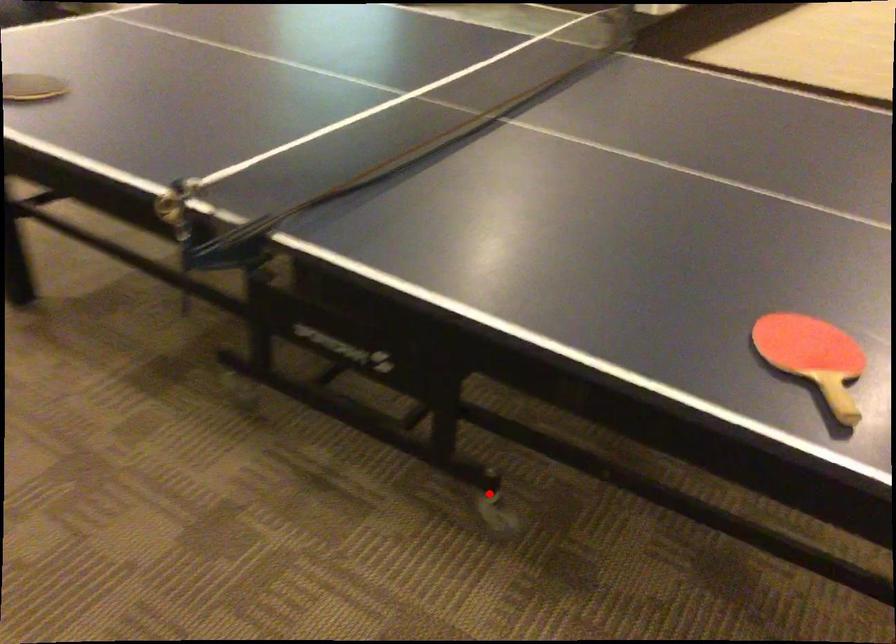
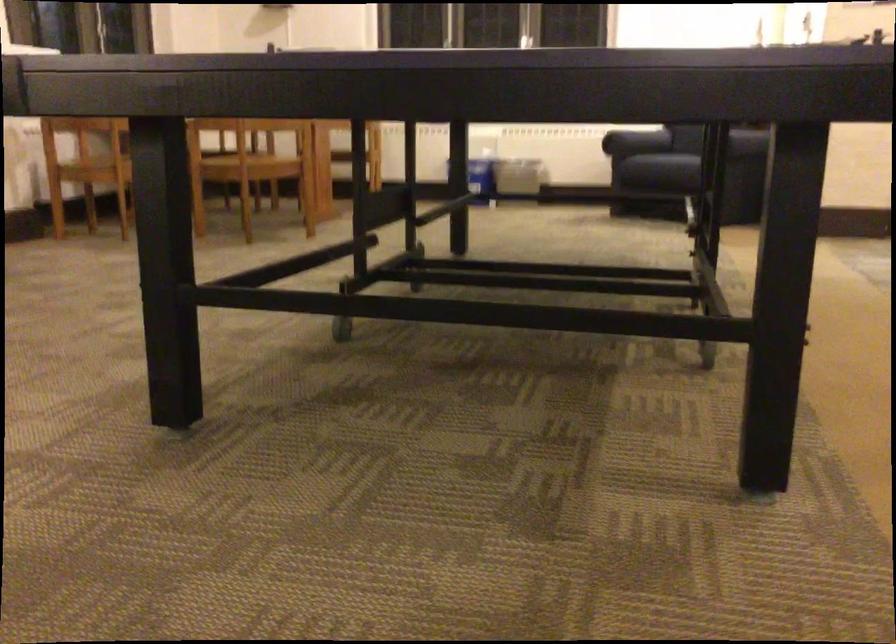
Question: I am providing you with two images of the same scene from different viewpoints. A red point is marked on the first image. Can you still see the location of the red point in image 2?

Choices:
 (A) Yes
 (B) No

Answer: (B)